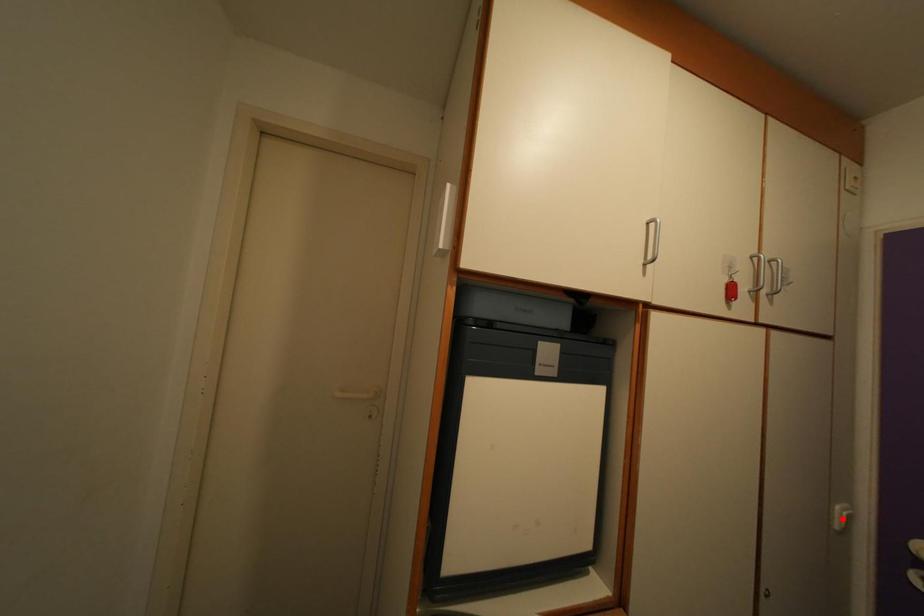
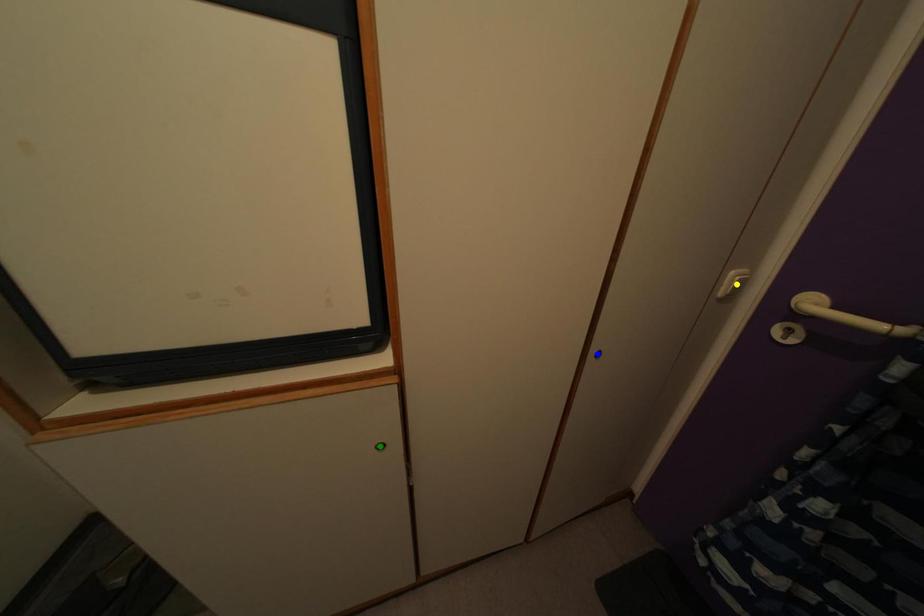
Question: I am providing you with two images of the same scene from different viewpoints. A red point is marked on the first image. You are given multiple points on the second image. Which mark in image 2 goes with the point in image 1?

Choices:
 (A) green point
 (B) blue point
 (C) yellow point

Answer: (C)